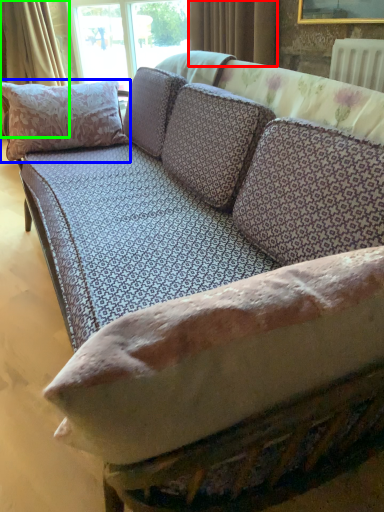
Question: Considering the real-world distances, which object is closest to curtain (highlighted by a red box)? pillow (highlighted by a blue box) or curtain (highlighted by a green box).

Choices:
 (A) pillow
 (B) curtain

Answer: (A)